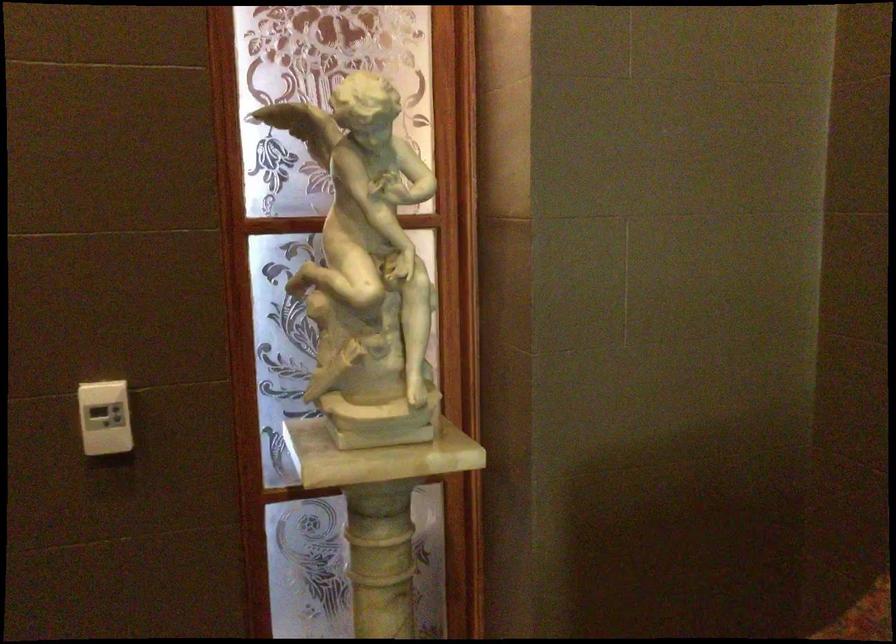
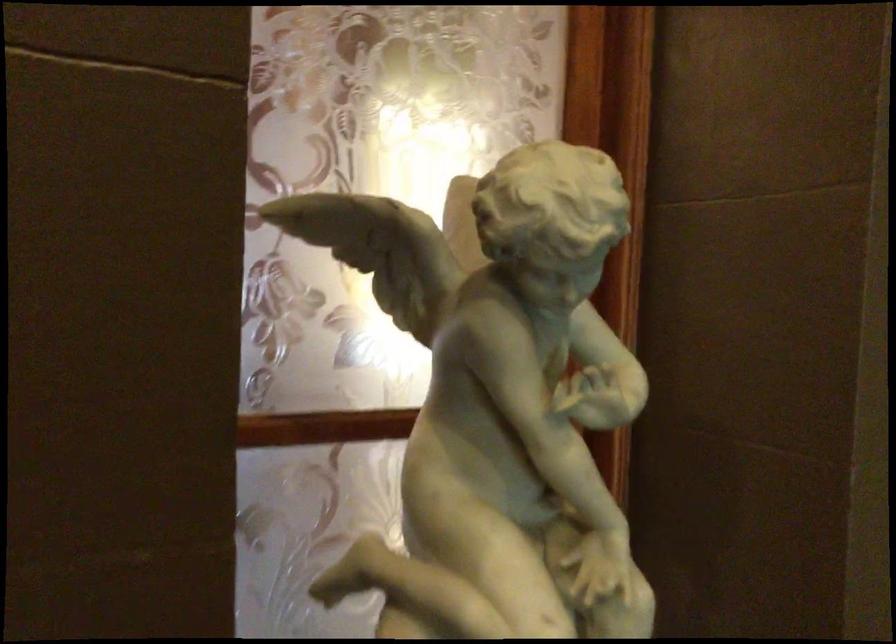
Question: Based on the continuous images, in which direction is the camera rotating? Reply with the corresponding letter.

Choices:
 (A) Left
 (B) Right
 (C) Up
 (D) Down

Answer: (B)